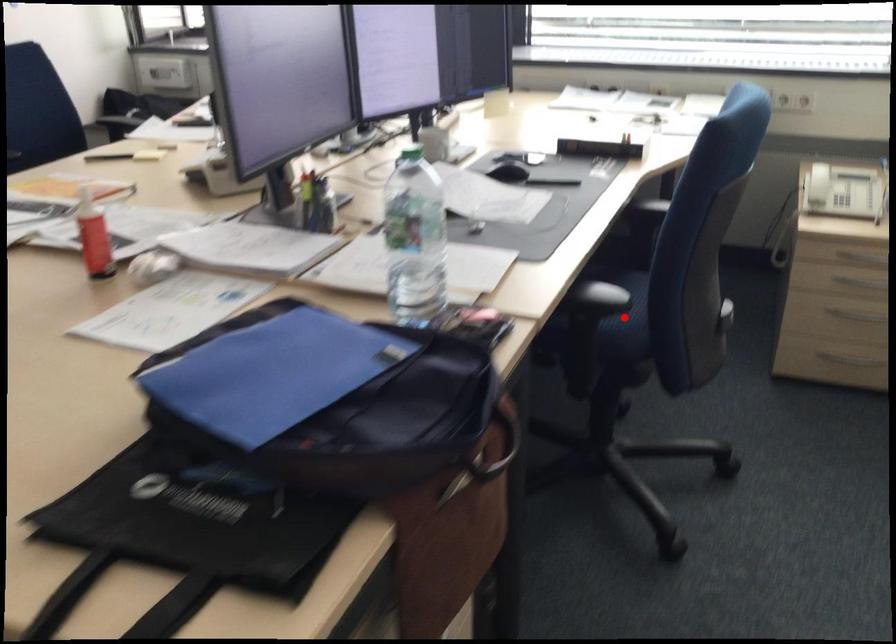
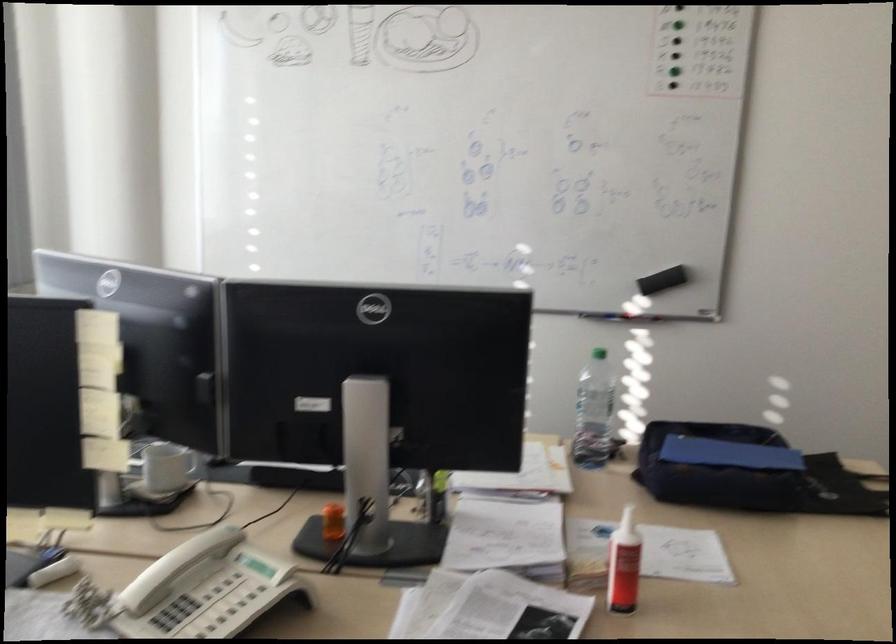
Question: I am providing you with two images of the same scene from different viewpoints. A red point is marked on the first image. Is the red point's position out of view in image 2?

Choices:
 (A) Yes
 (B) No

Answer: (A)